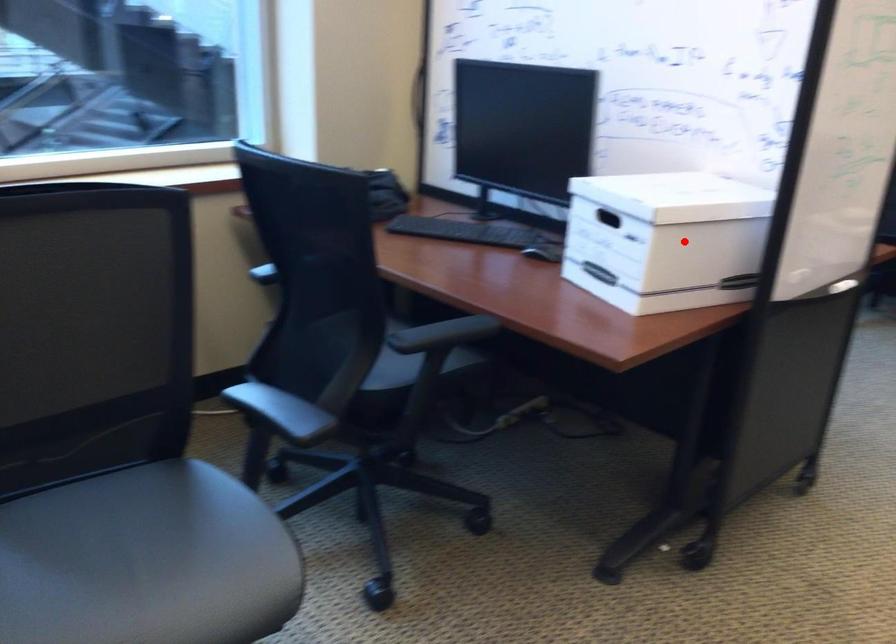
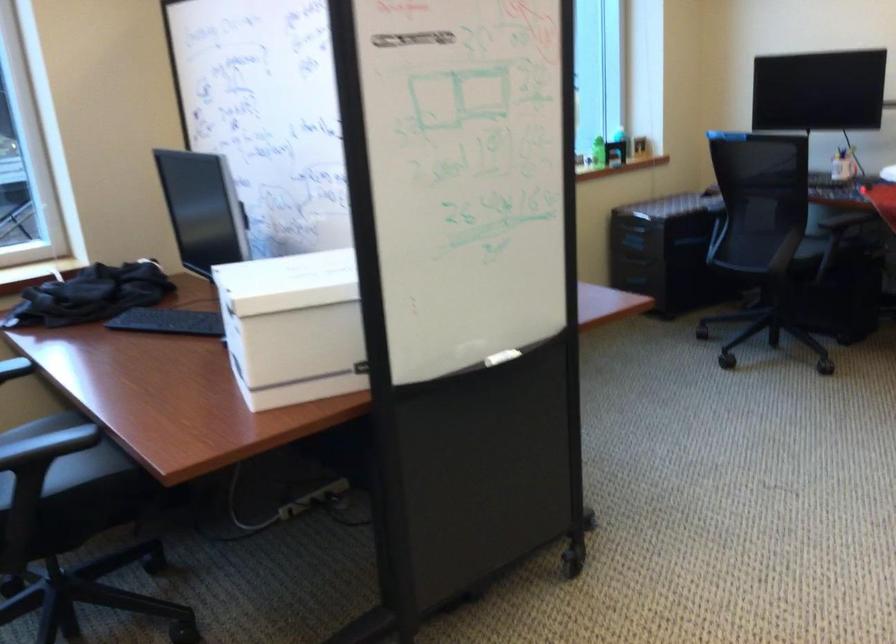
Where in the second image is the point corresponding to the highlighted location from the first image?

(293, 327)